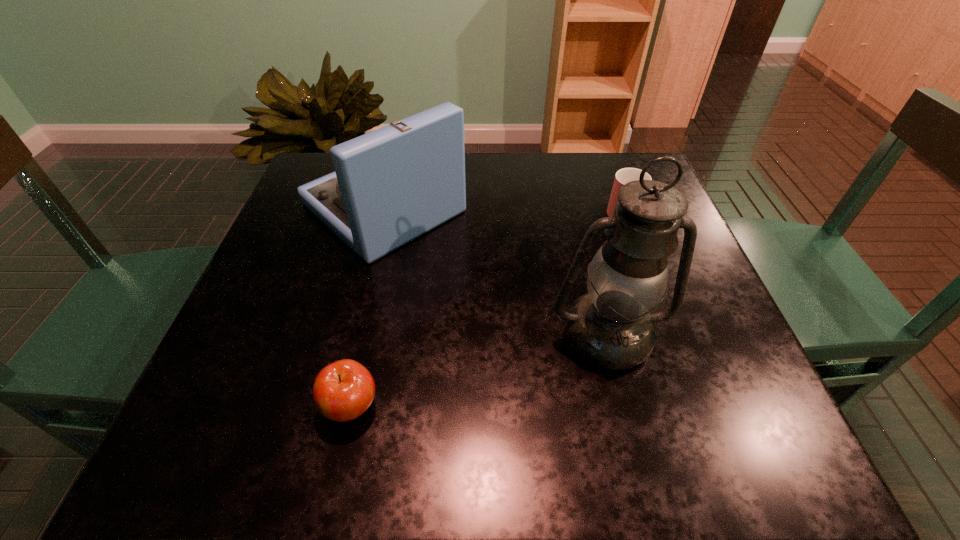
At what (x,y) coordinates should I click in order to perform the action: click on the tallest object. Please return your answer as a coordinate pair (x, y). The height and width of the screenshot is (540, 960). Looking at the image, I should click on (611, 327).

In order to click on the third farthest object in this screenshot , I will do `click(611, 327)`.

I want to click on phonograph record, so click(x=390, y=186).

You are a GUI agent. You are given a task and a screenshot of the screen. Output one action in this format:
    pyautogui.click(x=<x>, y=<y>)
    Task: Click on the cup
    This screenshot has height=540, width=960.
    Given the screenshot: What is the action you would take?
    pyautogui.click(x=623, y=176)

This screenshot has height=540, width=960. Identify the location of the nearest object. point(343,390).

Where is `vacant area situated on the left of the tallest object`? This screenshot has height=540, width=960. vacant area situated on the left of the tallest object is located at coordinates (415, 335).

What are the coordinates of `free spot located 0.320m on the right of the second tallest object` in the screenshot? It's located at (601, 207).

At what (x,y) coordinates should I click in order to perform the action: click on vacant space located on the side of the cup with the handle. Please return your answer as a coordinate pair (x, y). This screenshot has width=960, height=540. Looking at the image, I should click on (607, 168).

This screenshot has height=540, width=960. In order to click on free point located on the side of the cup with the handle in this screenshot , I will do `click(612, 183)`.

Where is `vacant space located 0.190m on the side of the cup with the handle`? The image size is (960, 540). vacant space located 0.190m on the side of the cup with the handle is located at coordinates (602, 154).